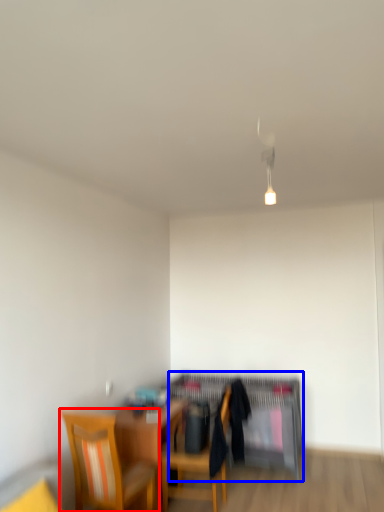
Question: Among these objects, which one is nearest to the camera, chair (highlighted by a red box) or computer desk (highlighted by a blue box)?

Choices:
 (A) chair
 (B) computer desk

Answer: (A)